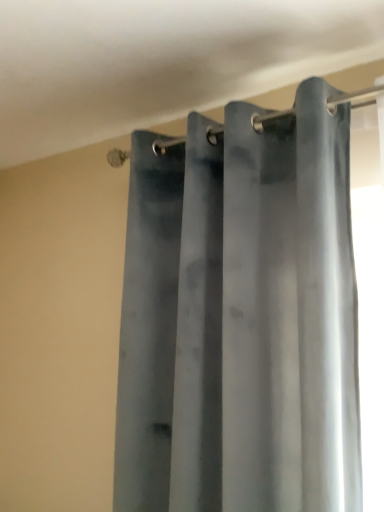
Where is `velvet gray curtain at center`? The image size is (384, 512). velvet gray curtain at center is located at coordinates (241, 315).

In the scene shown: In order to face velvet gray curtain at center, should I rotate leftwards or rightwards?

It's best to rotate right around 3.150 degrees.

Measure the distance between velvet gray curtain at center and camera.

velvet gray curtain at center and camera are 92.65 centimeters apart from each other.

Describe the element at coordinates (241, 315) in the screenshot. The width and height of the screenshot is (384, 512). I see `velvet gray curtain at center` at that location.

Where is `velvet gray curtain at center`? The height and width of the screenshot is (512, 384). velvet gray curtain at center is located at coordinates (241, 315).